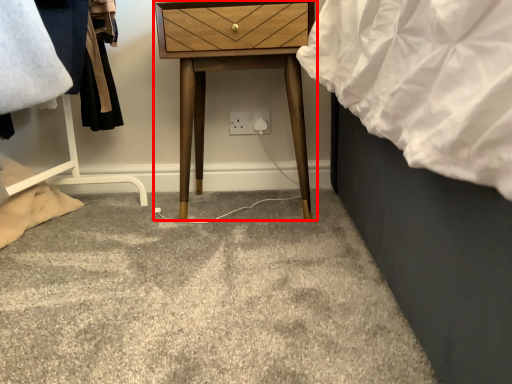
Question: Where is nightstand (annotated by the red box) located in relation to electric outlet in the image?

Choices:
 (A) left
 (B) right

Answer: (A)